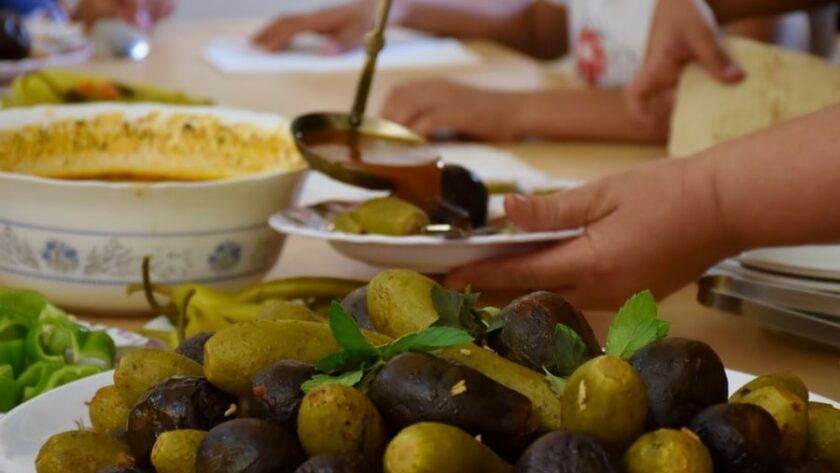
You are a GUI agent. You are given a task and a screenshot of the screen. Output one action in this format:
    pyautogui.click(x=<x>, y=<y>)
    Task: Click on the bowl
    
    Given the screenshot: What is the action you would take?
    pyautogui.click(x=143, y=212)